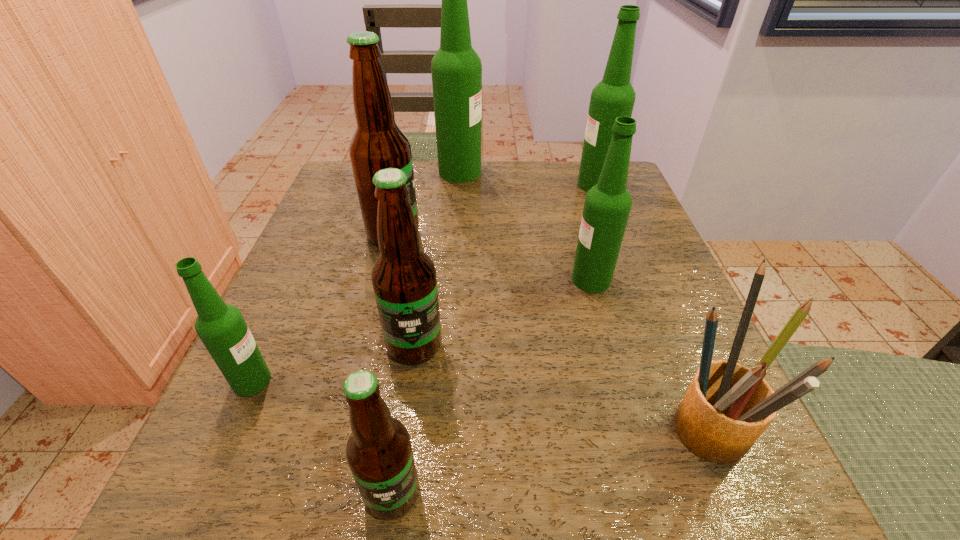
The image size is (960, 540). Find the location of `free area in between the second nearest brown beer bottle and the nearest brown beer bottle`. free area in between the second nearest brown beer bottle and the nearest brown beer bottle is located at coordinates (403, 419).

I want to click on free space that is in between the pencil box and the second nearest brown beer bottle, so click(x=557, y=383).

Where is `empty space between the pencil box and the fourth nearest beer bottle`? The height and width of the screenshot is (540, 960). empty space between the pencil box and the fourth nearest beer bottle is located at coordinates (645, 351).

This screenshot has width=960, height=540. I want to click on free point between the smallest green beer bottle and the pencil box, so click(476, 401).

Where is `object that ranks as the sixth closest to the third green beer bottle from right to left`? This screenshot has height=540, width=960. object that ranks as the sixth closest to the third green beer bottle from right to left is located at coordinates (726, 408).

Locate an element on the screen. This screenshot has width=960, height=540. object that ranks as the third closest to the second nearest brown beer bottle is located at coordinates (378, 143).

Select which beer bottle appears as the fourth closest to the biggest green beer bottle. Please provide its 2D coordinates. Your answer should be formatted as a tuple, i.e. [(x, y)], where the tuple contains the x and y coordinates of a point satisfying the conditions above.

[(404, 279)]

Identify which beer bottle is the closest to the leftmost beer bottle. Please provide its 2D coordinates. Your answer should be formatted as a tuple, i.e. [(x, y)], where the tuple contains the x and y coordinates of a point satisfying the conditions above.

[(404, 279)]

Identify the location of the second closest green beer bottle to the nearest brown beer bottle. (607, 205).

Locate an element on the screen. green beer bottle that can be found as the closest to the third farthest beer bottle is located at coordinates (456, 68).